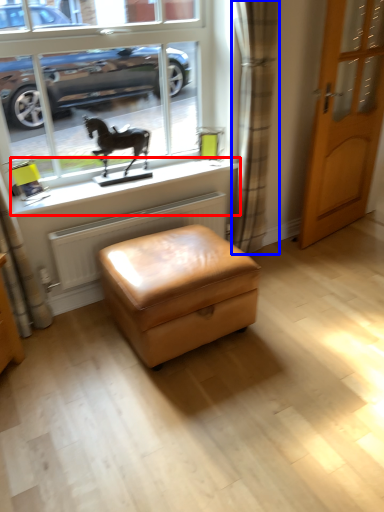
Question: Which point is closer to the camera, window sill (highlighted by a red box) or curtain (highlighted by a blue box)?

Choices:
 (A) window sill
 (B) curtain

Answer: (B)